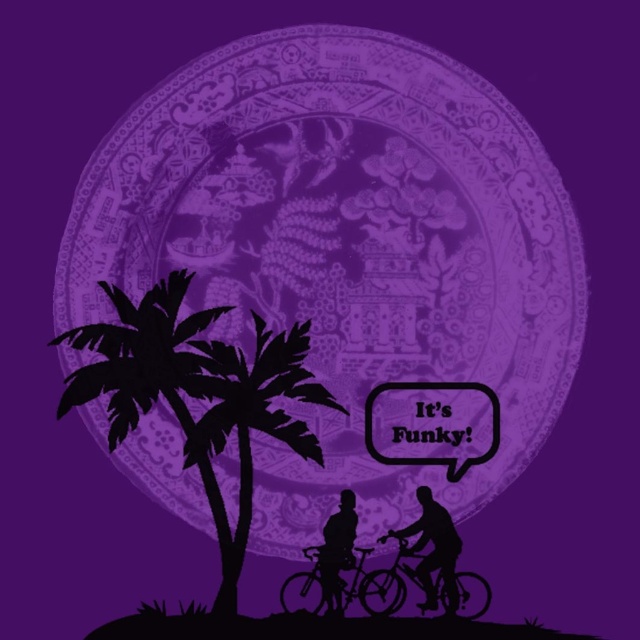
Can you confirm if black silhouette palm tree at left is wider than black matte bicycle at lower right?

Yes.

Identify the location of black silhouette palm tree at left. Image resolution: width=640 pixels, height=640 pixels. (157, 390).

Is point (97, 344) farther from viewer compared to point (444, 525)?

No, it is in front of (444, 525).

Identify the location of black silhouette palm tree at left. This screenshot has height=640, width=640. (157, 390).

Can you confirm if metallic bicycle at center is positioned below silhouette bicycle rider at lower center?

Correct, metallic bicycle at center is located below silhouette bicycle rider at lower center.

Does metallic bicycle at center have a smaller size compared to silhouette bicycle rider at lower center?

No.

Which is in front, point (381, 612) or point (321, 584)?

Positioned in front is point (381, 612).

Identify the location of metallic bicycle at center. This screenshot has height=640, width=640. (372, 586).

Who is positioned more to the right, black silhouette palm tree at left or metallic bicycle at lower right?

Positioned to the right is metallic bicycle at lower right.

Between black silhouette palm tree at left and metallic bicycle at lower right, which one is positioned lower?

metallic bicycle at lower right

Where is `black silhouette palm tree at left`? This screenshot has width=640, height=640. black silhouette palm tree at left is located at coordinates click(x=157, y=390).